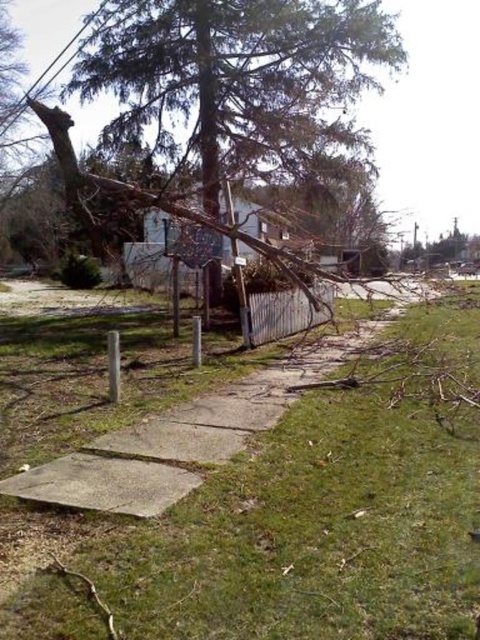
Question: Among these points, which one is farthest from the camera?

Choices:
 (A) (295, 486)
 (B) (476, 260)
 (C) (268, 332)
 (D) (259, 150)

Answer: (B)

Question: Estimate the real-world distances between objects in this image. Which object is closer to the white wood fence at center?

Choices:
 (A) brown rough bark tree at right
 (B) green grass at lower center
 (C) green textured tree at upper center

Answer: (C)

Question: Which object is the closest to the brown rough bark tree at right?

Choices:
 (A) white wood fence at center
 (B) green textured tree at upper center
 (C) green grass at lower center

Answer: (B)

Question: Is green textured tree at upper center to the right of brown rough bark tree at right from the viewer's perspective?

Choices:
 (A) yes
 (B) no

Answer: (B)

Question: Can you confirm if green textured tree at upper center is bigger than white wood fence at center?

Choices:
 (A) yes
 (B) no

Answer: (B)

Question: Does green textured tree at upper center have a smaller size compared to white wood fence at center?

Choices:
 (A) yes
 (B) no

Answer: (A)